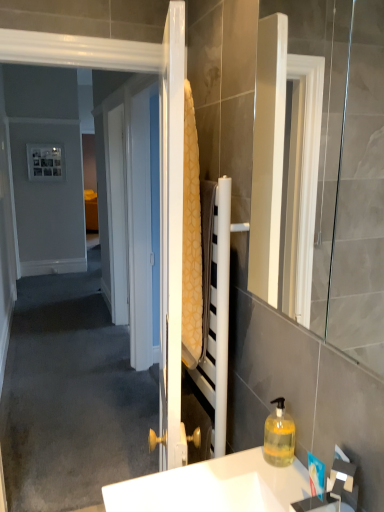
Question: Should I look upward or downward to see yellow textured towel at center?

Choices:
 (A) up
 (B) down

Answer: (A)

Question: Is white glossy mirror at right taller than translucent yellow liquid at lower right?

Choices:
 (A) no
 (B) yes

Answer: (B)

Question: From the image's perspective, is white glossy mirror at right below translucent yellow liquid at lower right?

Choices:
 (A) no
 (B) yes

Answer: (A)

Question: Could translucent yellow liquid at lower right be considered to be inside white glossy mirror at right?

Choices:
 (A) no
 (B) yes

Answer: (A)

Question: Is the surface of white glossy mirror at right in direct contact with translucent yellow liquid at lower right?

Choices:
 (A) no
 (B) yes

Answer: (A)

Question: Considering the relative sizes of white glossy mirror at right and translucent yellow liquid at lower right in the image provided, is white glossy mirror at right smaller than translucent yellow liquid at lower right?

Choices:
 (A) no
 (B) yes

Answer: (A)

Question: Is white glossy mirror at right turned away from translucent yellow liquid at lower right?

Choices:
 (A) yes
 (B) no

Answer: (B)

Question: From the image's perspective, is yellow textured towel at center below translucent yellow liquid at lower right?

Choices:
 (A) yes
 (B) no

Answer: (B)

Question: Is yellow textured towel at center facing away from translucent yellow liquid at lower right?

Choices:
 (A) yes
 (B) no

Answer: (B)

Question: Is yellow textured towel at center bigger than translucent yellow liquid at lower right?

Choices:
 (A) no
 (B) yes

Answer: (B)

Question: Does yellow textured towel at center have a smaller size compared to translucent yellow liquid at lower right?

Choices:
 (A) no
 (B) yes

Answer: (A)

Question: Is the depth of yellow textured towel at center greater than that of translucent yellow liquid at lower right?

Choices:
 (A) no
 (B) yes

Answer: (A)

Question: Does yellow textured towel at center have a lesser width compared to translucent yellow liquid at lower right?

Choices:
 (A) no
 (B) yes

Answer: (B)

Question: From a real-world perspective, is translucent yellow liquid at lower right located beneath white glossy mirror at right?

Choices:
 (A) no
 (B) yes

Answer: (B)